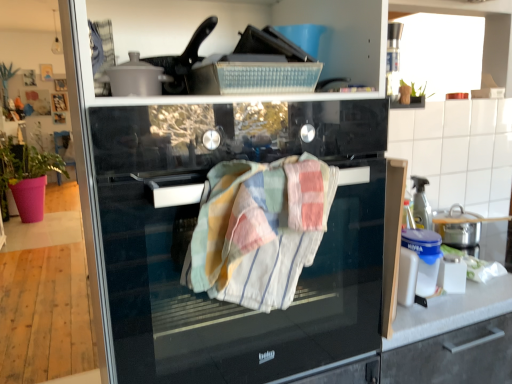
Question: Can you confirm if pink fabric plant at left is bigger than multicolored woven towel at center?

Choices:
 (A) no
 (B) yes

Answer: (B)

Question: Could you tell me if pink fabric plant at left is facing multicolored woven towel at center?

Choices:
 (A) no
 (B) yes

Answer: (A)

Question: From the image's perspective, is pink fabric plant at left below multicolored woven towel at center?

Choices:
 (A) yes
 (B) no

Answer: (B)

Question: Does pink fabric plant at left have a lesser width compared to multicolored woven towel at center?

Choices:
 (A) no
 (B) yes

Answer: (A)

Question: Is pink fabric plant at left to the right of multicolored woven towel at center from the viewer's perspective?

Choices:
 (A) yes
 (B) no

Answer: (B)

Question: Is multicolored woven towel at center at the back of pink fabric plant at left?

Choices:
 (A) no
 (B) yes

Answer: (A)

Question: Is black glass oven at center facing towards pink fabric plant at left?

Choices:
 (A) no
 (B) yes

Answer: (A)

Question: From a real-world perspective, is black glass oven at center over pink fabric plant at left?

Choices:
 (A) yes
 (B) no

Answer: (A)

Question: Is pink fabric plant at left at the back of black glass oven at center?

Choices:
 (A) yes
 (B) no

Answer: (A)

Question: Considering the relative sizes of black glass oven at center and pink fabric plant at left in the image provided, is black glass oven at center smaller than pink fabric plant at left?

Choices:
 (A) yes
 (B) no

Answer: (A)

Question: Does black glass oven at center have a greater width compared to pink fabric plant at left?

Choices:
 (A) no
 (B) yes

Answer: (A)

Question: Is pink fabric plant at left a part of black glass oven at center?

Choices:
 (A) no
 (B) yes

Answer: (A)

Question: Can you confirm if black glass oven at center is thinner than multicolored woven towel at center?

Choices:
 (A) no
 (B) yes

Answer: (A)